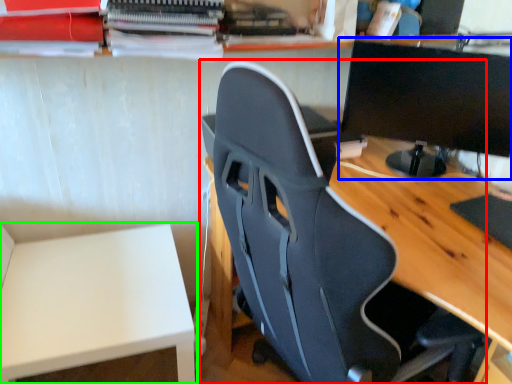
Question: Based on their relative distances, which object is farther from chair (highlighted by a red box)? Choose from computer monitor (highlighted by a blue box) and table (highlighted by a green box).

Choices:
 (A) computer monitor
 (B) table

Answer: (A)